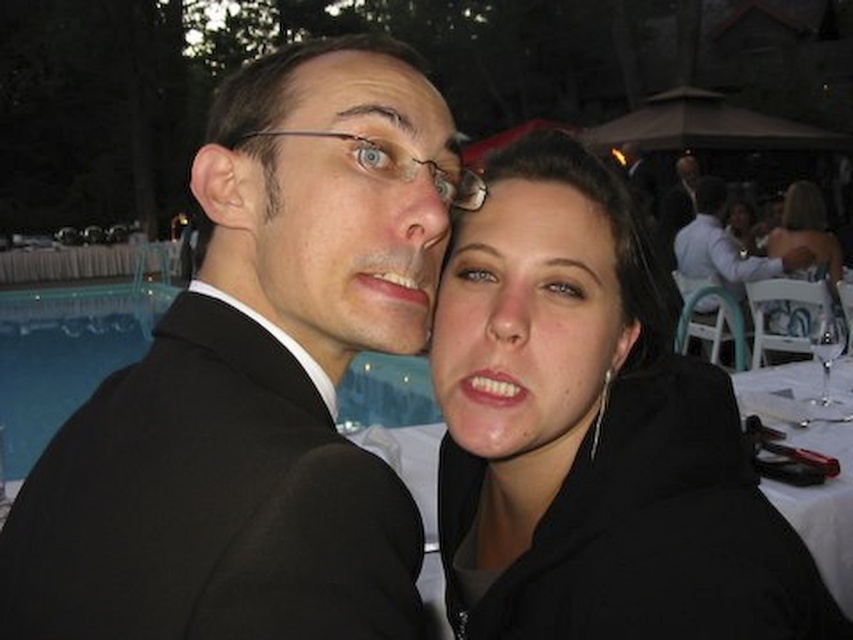
You are a photographer adjusting the lighting for a portrait. You notice the smooth skin face at upper right and the matte black suit at center in your frame. Which object should you adjust the lighting for to ensure proper exposure, considering their relative heights?

The smooth skin face at upper right has a greater height compared to the matte black suit at center, so you should adjust the lighting for the smooth skin face at upper right to ensure proper exposure.

You are at a party and need to find the black suit at center. Where is it located relative to the white glossy table at lower right?

The black suit at center is to the left of the white glossy table at lower right.

You are a photographer at an evening event and need to adjust your camera settings to focus on both the black suit at center and the white glossy table at lower right. Which object should you focus on first if you want to ensure the one closer to the camera is sharp?

The black suit at center is above the white glossy table at lower right, meaning it is closer to the camera. Focus on the black suit at center first to ensure sharpness.